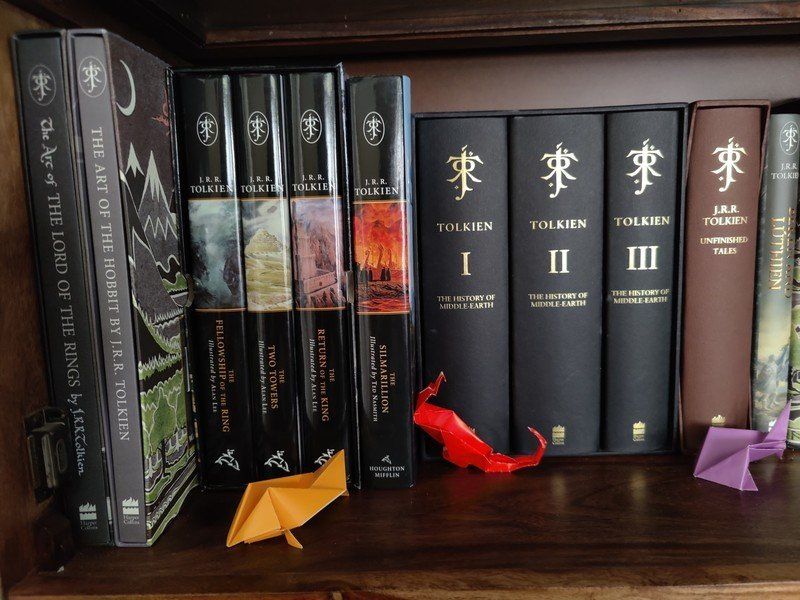
Locate an element on the screen. The width and height of the screenshot is (800, 600). dark red spine on books is located at coordinates (709, 333), (710, 301).